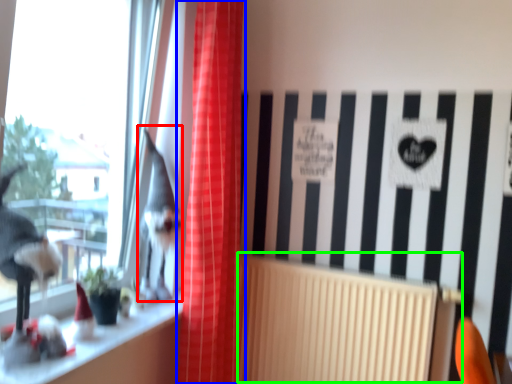
Question: Which object is positioned closest to animal (highlighted by a red box)? Select from curtain (highlighted by a blue box) and radiator (highlighted by a green box).

Choices:
 (A) curtain
 (B) radiator

Answer: (A)